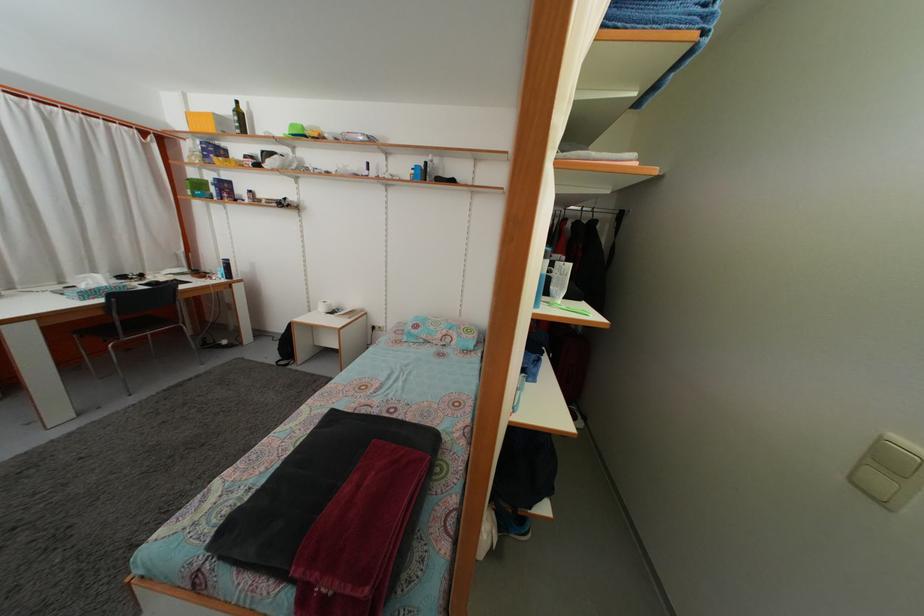
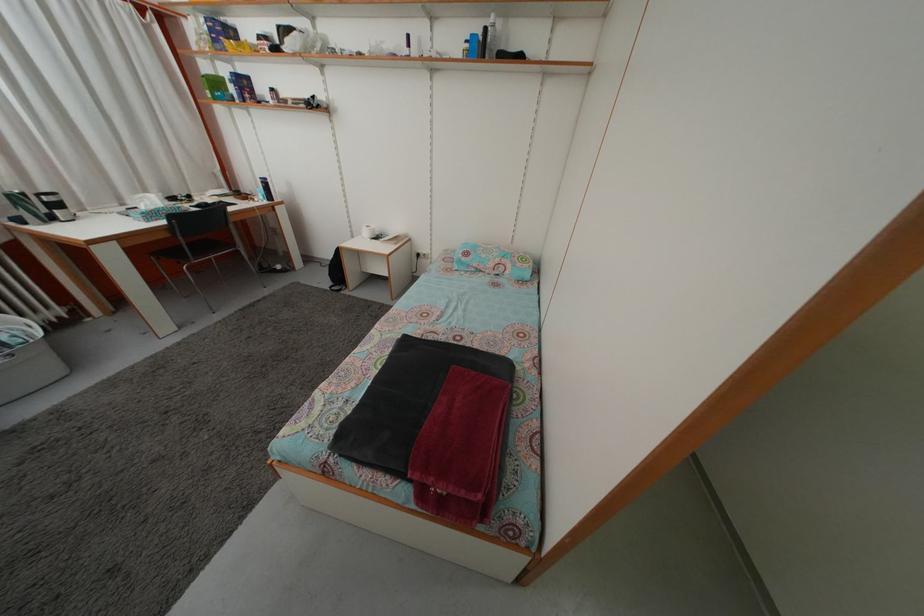
Locate, in the second image, the point that corresponds to (205,192) in the first image.

(223, 91)